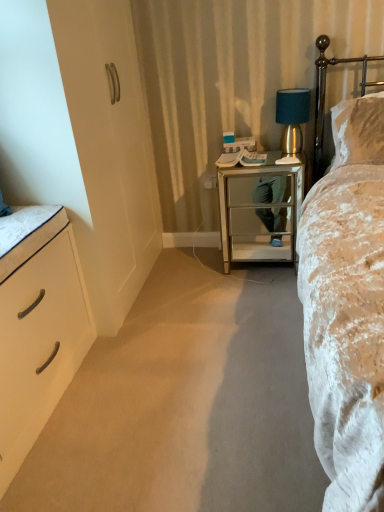
Question: Is white matte chest of drawers at left completely or partially inside silver mirrored nightstand at center?

Choices:
 (A) yes
 (B) no

Answer: (B)

Question: Considering the relative sizes of silver mirrored nightstand at center and white matte chest of drawers at left in the image provided, is silver mirrored nightstand at center bigger than white matte chest of drawers at left?

Choices:
 (A) yes
 (B) no

Answer: (B)

Question: Considering the relative sizes of silver mirrored nightstand at center and white matte chest of drawers at left in the image provided, is silver mirrored nightstand at center shorter than white matte chest of drawers at left?

Choices:
 (A) no
 (B) yes

Answer: (A)

Question: Can you confirm if silver mirrored nightstand at center is thinner than white matte chest of drawers at left?

Choices:
 (A) yes
 (B) no

Answer: (A)

Question: Is silver mirrored nightstand at center wider than white matte chest of drawers at left?

Choices:
 (A) no
 (B) yes

Answer: (A)

Question: Is silver mirrored nightstand at center outside white matte chest of drawers at left?

Choices:
 (A) yes
 (B) no

Answer: (A)

Question: From a real-world perspective, is silver mirrored nightstand at center positioned over velvet beige bed at right based on gravity?

Choices:
 (A) yes
 (B) no

Answer: (B)

Question: Considering the relative sizes of silver mirrored nightstand at center and velvet beige bed at right in the image provided, is silver mirrored nightstand at center smaller than velvet beige bed at right?

Choices:
 (A) yes
 (B) no

Answer: (A)

Question: Is silver mirrored nightstand at center aimed at velvet beige bed at right?

Choices:
 (A) no
 (B) yes

Answer: (B)

Question: Is silver mirrored nightstand at center at the right side of velvet beige bed at right?

Choices:
 (A) yes
 (B) no

Answer: (B)

Question: Is silver mirrored nightstand at center completely or partially outside of velvet beige bed at right?

Choices:
 (A) no
 (B) yes

Answer: (B)

Question: Is silver mirrored nightstand at center oriented away from velvet beige bed at right?

Choices:
 (A) yes
 (B) no

Answer: (B)

Question: Is gold metallic headboard at upper right not near white matte chest of drawers at left?

Choices:
 (A) yes
 (B) no

Answer: (A)